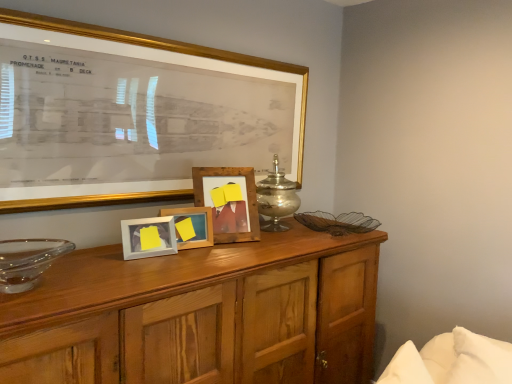
The height and width of the screenshot is (384, 512). What do you see at coordinates (148, 237) in the screenshot?
I see `white matte picture frame at center, marked as the third picture frame in a back-to-front arrangement` at bounding box center [148, 237].

What is the approximate width of wooden cabinet at center?

It is 23.90 inches.

Identify the location of transparent glass bowl at left. pos(28,261).

You are a GUI agent. You are given a task and a screenshot of the screen. Output one action in this format:
    pyautogui.click(x=<x>, y=<y>)
    Task: Click on the white soft bed at lower right
    The image size is (512, 384).
    Given the screenshot: What is the action you would take?
    pyautogui.click(x=450, y=360)

What do you see at coordinates (192, 226) in the screenshot? I see `wooden photo frame at center, marked as the second picture frame in a back-to-front arrangement` at bounding box center [192, 226].

What do you see at coordinates (276, 198) in the screenshot? The width and height of the screenshot is (512, 384). I see `silver metallic candle holder at center` at bounding box center [276, 198].

Image resolution: width=512 pixels, height=384 pixels. Describe the element at coordinates (229, 201) in the screenshot. I see `wooden photo frame at center, which is the 4th picture frame from front to back` at that location.

In order to click on white matte picture frame at center, which appears as the 2th picture frame when viewed from the front in this screenshot , I will do `click(148, 237)`.

Is transparent glass bowl at left oriented towards silver metallic candle holder at center?

No, transparent glass bowl at left is not turned towards silver metallic candle holder at center.

Does transparent glass bowl at left have a greater height compared to silver metallic candle holder at center?

Incorrect, the height of transparent glass bowl at left is not larger of that of silver metallic candle holder at center.

How far apart are transparent glass bowl at left and silver metallic candle holder at center?

transparent glass bowl at left and silver metallic candle holder at center are 35.83 inches apart.

Which is more distant, [44,241] or [280,227]?

The point [280,227] is behind.

Is wooden photo frame at center, the first picture frame when ordered from back to front, positioned beyond the bounds of gold framed picture at upper center, the 1th picture frame viewed from the front?

That's correct, wooden photo frame at center, the first picture frame when ordered from back to front, is outside of gold framed picture at upper center, the 1th picture frame viewed from the front.

From the image's perspective, is wooden photo frame at center, the first picture frame when ordered from back to front, located above gold framed picture at upper center, placed as the fourth picture frame when sorted from back to front?

Incorrect, from the image's perspective, wooden photo frame at center, the first picture frame when ordered from back to front, is lower than gold framed picture at upper center, placed as the fourth picture frame when sorted from back to front.

Does wooden photo frame at center, the first picture frame when ordered from back to front, come in front of gold framed picture at upper center, placed as the fourth picture frame when sorted from back to front?

That is False.

Between wooden photo frame at center, which is the 4th picture frame from front to back, and gold framed picture at upper center, the 1th picture frame viewed from the front, which one appears on the right side from the viewer's perspective?

Positioned to the right is wooden photo frame at center, which is the 4th picture frame from front to back.

Does point (158, 247) lie behind point (284, 209)?

No, (158, 247) is in front of (284, 209).

Between white matte picture frame at center, marked as the third picture frame in a back-to-front arrangement, and silver metallic candle holder at center, which one has larger width?

silver metallic candle holder at center.

Consider the image. In terms of height, does white matte picture frame at center, marked as the third picture frame in a back-to-front arrangement, look taller or shorter compared to silver metallic candle holder at center?

Clearly, white matte picture frame at center, marked as the third picture frame in a back-to-front arrangement, is shorter compared to silver metallic candle holder at center.

Which of these two, wooden cabinet at center or white matte picture frame at center, which appears as the 2th picture frame when viewed from the front, stands shorter?

white matte picture frame at center, which appears as the 2th picture frame when viewed from the front, is shorter.

Find the location of a particular element. The image size is (512, 384). picture frame that is the 2nd object located behind the wooden cabinet at center is located at coordinates (148, 237).

Is wooden cabinet at center far away from white matte picture frame at center, marked as the third picture frame in a back-to-front arrangement?

No, wooden cabinet at center is in close proximity to white matte picture frame at center, marked as the third picture frame in a back-to-front arrangement.

Is point (165, 277) closer or farther from the camera than point (153, 226)?

Point (165, 277) is positioned closer to the camera compared to point (153, 226).

In the image, is white matte picture frame at center, which appears as the 2th picture frame when viewed from the front, positioned in front of or behind wooden photo frame at center, the 3th picture frame from the front?

white matte picture frame at center, which appears as the 2th picture frame when viewed from the front, is in front of wooden photo frame at center, the 3th picture frame from the front.

Does white matte picture frame at center, which appears as the 2th picture frame when viewed from the front, have a lesser width compared to wooden photo frame at center, the 3th picture frame from the front?

Yes, white matte picture frame at center, which appears as the 2th picture frame when viewed from the front, is thinner than wooden photo frame at center, the 3th picture frame from the front.

I want to click on picture frame below the wooden photo frame at center, the 3th picture frame from the front (from a real-world perspective), so click(x=148, y=237).

Measure the distance from transparent glass bowl at left to wooden photo frame at center, which is the 4th picture frame from front to back.

A distance of 25.03 inches exists between transparent glass bowl at left and wooden photo frame at center, which is the 4th picture frame from front to back.

Considering the positions of objects transparent glass bowl at left and wooden photo frame at center, which is the 4th picture frame from front to back, in the image provided, who is behind, transparent glass bowl at left or wooden photo frame at center, which is the 4th picture frame from front to back,?

Positioned behind is wooden photo frame at center, which is the 4th picture frame from front to back.

Considering the sizes of objects transparent glass bowl at left and wooden photo frame at center, which is the 4th picture frame from front to back, in the image provided, who is thinner, transparent glass bowl at left or wooden photo frame at center, which is the 4th picture frame from front to back,?

Thinner between the two is wooden photo frame at center, which is the 4th picture frame from front to back.

Does transparent glass bowl at left touch wooden photo frame at center, which is the 4th picture frame from front to back?

No, transparent glass bowl at left is not touching wooden photo frame at center, which is the 4th picture frame from front to back.

Between wooden photo frame at center, which is the 4th picture frame from front to back, and white soft bed at lower right, which one appears on the left side from the viewer's perspective?

wooden photo frame at center, which is the 4th picture frame from front to back, is more to the left.

Can we say wooden photo frame at center, which is the 4th picture frame from front to back, lies outside white soft bed at lower right?

Absolutely, wooden photo frame at center, which is the 4th picture frame from front to back, is external to white soft bed at lower right.

Considering the sizes of objects wooden photo frame at center, which is the 4th picture frame from front to back, and white soft bed at lower right in the image provided, who is taller, wooden photo frame at center, which is the 4th picture frame from front to back, or white soft bed at lower right?

white soft bed at lower right.

Does wooden photo frame at center, the first picture frame when ordered from back to front, have a larger size compared to white soft bed at lower right?

Incorrect, wooden photo frame at center, the first picture frame when ordered from back to front, is not larger than white soft bed at lower right.

Identify the location of candle holder above the transparent glass bowl at left (from a real-world perspective). This screenshot has width=512, height=384. (276, 198).

Where is `the 3rd picture frame behind the gold framed picture at upper center, the 1th picture frame viewed from the front, counting from the anchor's position`? Image resolution: width=512 pixels, height=384 pixels. the 3rd picture frame behind the gold framed picture at upper center, the 1th picture frame viewed from the front, counting from the anchor's position is located at coordinates (229, 201).

Considering their positions, is wooden photo frame at center, the 3th picture frame from the front, positioned closer to transparent glass bowl at left than white soft bed at lower right?

Among the two, wooden photo frame at center, the 3th picture frame from the front, is located nearer to transparent glass bowl at left.

Looking at the image, which one is located closer to wooden photo frame at center, which is the 4th picture frame from front to back, wooden photo frame at center, the 3th picture frame from the front, or transparent glass bowl at left?

wooden photo frame at center, the 3th picture frame from the front, lies closer to wooden photo frame at center, which is the 4th picture frame from front to back, than the other object.

Estimate the real-world distances between objects in this image. Which object is further from white matte picture frame at center, marked as the third picture frame in a back-to-front arrangement, wooden photo frame at center, the 3th picture frame from the front, or wooden cabinet at center?

wooden cabinet at center lies further to white matte picture frame at center, marked as the third picture frame in a back-to-front arrangement, than the other object.

From the image, which object appears to be farther from silver metallic candle holder at center, white matte picture frame at center, which appears as the 2th picture frame when viewed from the front, or gold framed picture at upper center, placed as the fourth picture frame when sorted from back to front?

The object further to silver metallic candle holder at center is white matte picture frame at center, which appears as the 2th picture frame when viewed from the front.

In the scene shown: Considering their positions, is wooden cabinet at center positioned closer to wooden photo frame at center, which is the 4th picture frame from front to back, than wooden photo frame at center, the 3th picture frame from the front?

Based on the image, wooden photo frame at center, the 3th picture frame from the front, appears to be nearer to wooden photo frame at center, which is the 4th picture frame from front to back.

Estimate the real-world distances between objects in this image. Which object is closer to wooden photo frame at center, the 3th picture frame from the front, wooden cabinet at center or transparent glass bowl at left?

wooden cabinet at center is positioned closer to the anchor wooden photo frame at center, the 3th picture frame from the front.

Looking at the image, which one is located further to wooden cabinet at center, gold framed picture at upper center, placed as the fourth picture frame when sorted from back to front, or transparent glass bowl at left?

gold framed picture at upper center, placed as the fourth picture frame when sorted from back to front, lies further to wooden cabinet at center than the other object.

Estimate the real-world distances between objects in this image. Which object is further from wooden photo frame at center, the 3th picture frame from the front, white matte picture frame at center, which appears as the 2th picture frame when viewed from the front, or wooden cabinet at center?

Among the two, wooden cabinet at center is located further to wooden photo frame at center, the 3th picture frame from the front.

At what (x,y) coordinates should I click in order to perform the action: click on cabinetry between white matte picture frame at center, marked as the third picture frame in a back-to-front arrangement, and white soft bed at lower right, in the horizontal direction. Please return your answer as a coordinate pair (x, y). The height and width of the screenshot is (384, 512). Looking at the image, I should click on (201, 314).

Identify the location of glass bowl positioned between wooden cabinet at center and wooden photo frame at center, the 3th picture frame from the front, from near to far. The width and height of the screenshot is (512, 384). (28, 261).

At what (x,y) coordinates should I click in order to perform the action: click on picture frame between gold framed picture at upper center, the 1th picture frame viewed from the front, and wooden photo frame at center, the 3th picture frame from the front, from top to bottom. Please return your answer as a coordinate pair (x, y). This screenshot has width=512, height=384. Looking at the image, I should click on (229, 201).

You are a GUI agent. You are given a task and a screenshot of the screen. Output one action in this format:
    pyautogui.click(x=<x>, y=<y>)
    Task: Click on the glass bowl between wooden cabinet at center and silver metallic candle holder at center from front to back
    This screenshot has height=384, width=512.
    Given the screenshot: What is the action you would take?
    pyautogui.click(x=28, y=261)